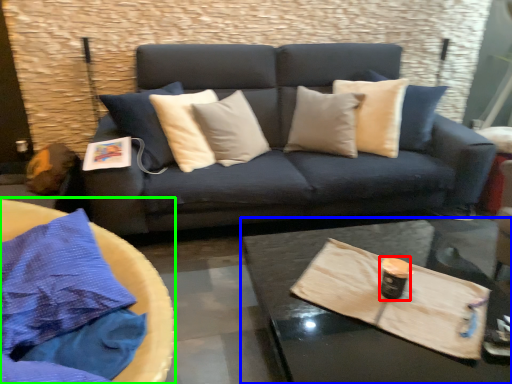
Question: Considering the real-world distances, which object is closest to beverage (highlighted by a red box)? coffee table (highlighted by a blue box) or round table (highlighted by a green box).

Choices:
 (A) coffee table
 (B) round table

Answer: (A)